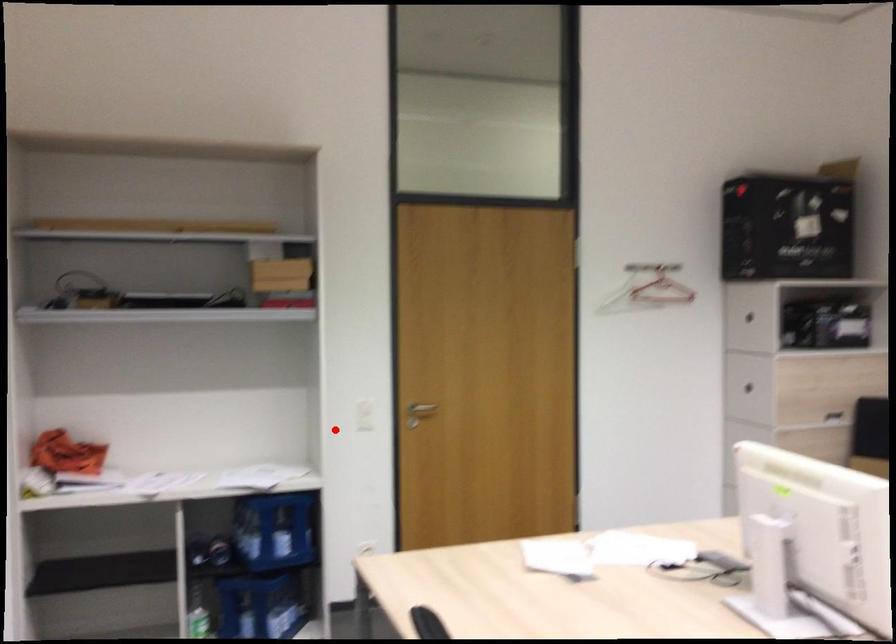
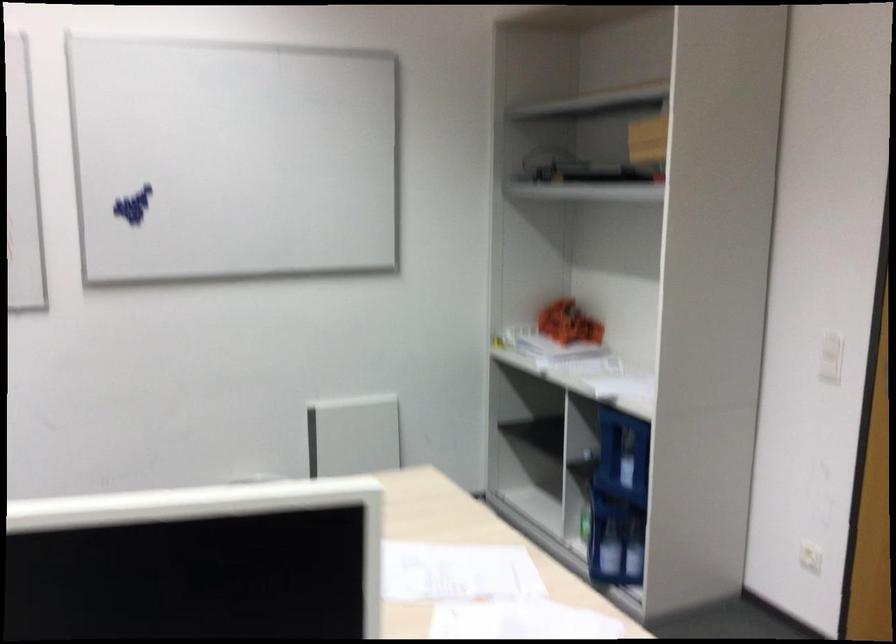
Locate, in the second image, the point that corresponds to the highlighted location in the first image.

(830, 357)